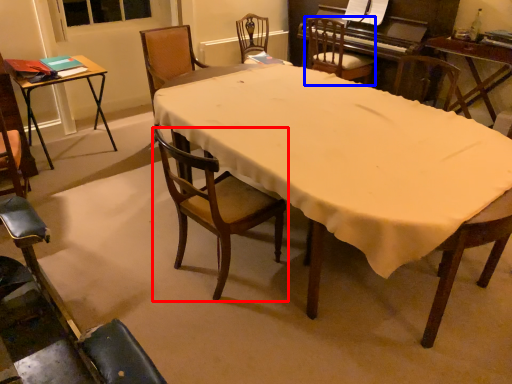
Question: Which object appears farthest to the camera in this image, chair (highlighted by a red box) or chair (highlighted by a blue box)?

Choices:
 (A) chair
 (B) chair

Answer: (B)